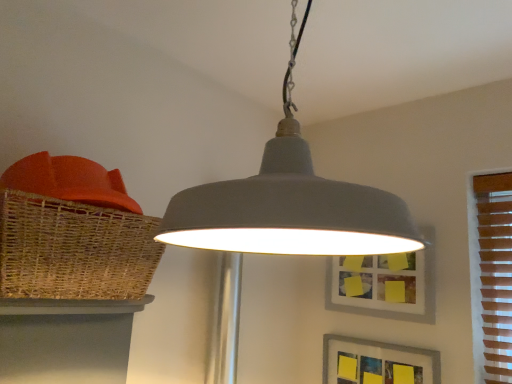
Question: Is matte gray pendant light at center taller or shorter than matte gray picture frame at center, the second picture frame in the bottom-to-top sequence?

Choices:
 (A) short
 (B) tall

Answer: (B)

Question: Is point tap(217, 223) closer or farther from the camera than point tap(368, 297)?

Choices:
 (A) closer
 (B) farther

Answer: (A)

Question: Which object is positioned closest to the matte wicker table at lower left?

Choices:
 (A) matte gray picture frame at center, the 1th picture frame from the top
 (B) woven brown basket at left
 (C) matte gray picture frame at lower right, the second picture frame when ordered from top to bottom
 (D) matte gray pendant light at center

Answer: (B)

Question: Which of these objects is positioned closest to the matte wicker table at lower left?

Choices:
 (A) matte gray picture frame at lower right, positioned as the first picture frame in bottom-to-top order
 (B) woven brown basket at left
 (C) matte gray picture frame at center, the second picture frame in the bottom-to-top sequence
 (D) matte gray pendant light at center

Answer: (B)